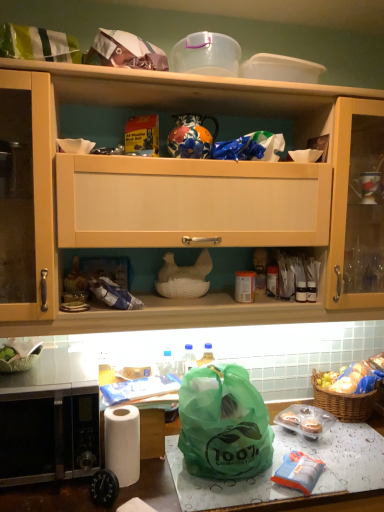
Question: Is translucent plastic cupcakes at lower right, which is counted as the 2th food, starting from the bottom, next to transparent plastic container at upper center?

Choices:
 (A) yes
 (B) no

Answer: (B)

Question: Is translucent plastic cupcakes at lower right, the second food positioned from the top, looking in the opposite direction of transparent plastic container at upper center?

Choices:
 (A) yes
 (B) no

Answer: (B)

Question: Is translucent plastic cupcakes at lower right, the second food positioned from the top, taller than transparent plastic container at upper center?

Choices:
 (A) yes
 (B) no

Answer: (B)

Question: Is translucent plastic cupcakes at lower right, the second food when ordered from back to front, not close to transparent plastic container at upper center?

Choices:
 (A) no
 (B) yes

Answer: (B)

Question: Is the depth of translucent plastic cupcakes at lower right, the second food positioned from the top, less than that of transparent plastic container at upper center?

Choices:
 (A) no
 (B) yes

Answer: (A)

Question: Considering the positions of matte plastic bag at lower center and brown woven picnic basket at lower right in the image, is matte plastic bag at lower center taller or shorter than brown woven picnic basket at lower right?

Choices:
 (A) short
 (B) tall

Answer: (B)

Question: Is matte plastic bag at lower center in front of or behind brown woven picnic basket at lower right in the image?

Choices:
 (A) behind
 (B) front

Answer: (B)

Question: Considering the positions of matte plastic bag at lower center and brown woven picnic basket at lower right in the image, is matte plastic bag at lower center bigger or smaller than brown woven picnic basket at lower right?

Choices:
 (A) big
 (B) small

Answer: (A)

Question: Based on their positions, is matte plastic bag at lower center located to the left or right of brown woven picnic basket at lower right?

Choices:
 (A) right
 (B) left

Answer: (B)

Question: From the image's perspective, is green plastic bag at lower center positioned above or below green plastic bag at lower center?

Choices:
 (A) above
 (B) below

Answer: (B)

Question: Based on their sizes in the image, would you say green plastic bag at lower center is bigger or smaller than green plastic bag at lower center?

Choices:
 (A) big
 (B) small

Answer: (B)

Question: In terms of width, does green plastic bag at lower center look wider or thinner when compared to green plastic bag at lower center?

Choices:
 (A) wide
 (B) thin

Answer: (A)

Question: Is green plastic bag at lower center in front of or behind green plastic bag at lower center in the image?

Choices:
 (A) behind
 (B) front

Answer: (B)

Question: Is point (347, 384) positioned closer to the camera than point (89, 457)?

Choices:
 (A) closer
 (B) farther

Answer: (B)

Question: Is green plastic bag at lower right, which is counted as the third food, starting from the front, inside or outside of stainless steel microwave at lower left?

Choices:
 (A) outside
 (B) inside

Answer: (A)